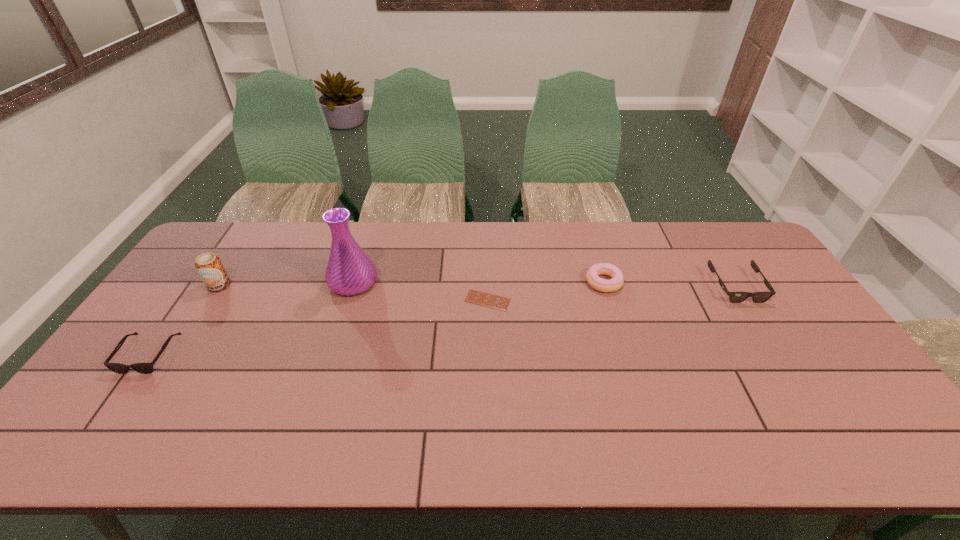
Where is `the tallest object`? The width and height of the screenshot is (960, 540). the tallest object is located at coordinates (350, 271).

Where is `vase`? This screenshot has width=960, height=540. vase is located at coordinates (350, 271).

This screenshot has width=960, height=540. I want to click on beer can, so click(x=209, y=266).

The image size is (960, 540). In order to click on doughnut in this screenshot , I will do `click(597, 283)`.

This screenshot has width=960, height=540. Identify the location of the farther sunglasses. (735, 297).

Image resolution: width=960 pixels, height=540 pixels. Find the location of `the rightmost object`. the rightmost object is located at coordinates (735, 297).

You are a GUI agent. You are given a task and a screenshot of the screen. Output one action in this format:
    pyautogui.click(x=<x>, y=<y>)
    Task: Click on the nearest object
    The image size is (960, 540).
    Given the screenshot: What is the action you would take?
    pyautogui.click(x=144, y=368)

Where is `the left sunglasses`? The width and height of the screenshot is (960, 540). the left sunglasses is located at coordinates [x=144, y=368].

Identify the location of chocolate bar. (476, 297).

Locate an element on the screen. This screenshot has width=960, height=540. the third object from right to left is located at coordinates (476, 297).